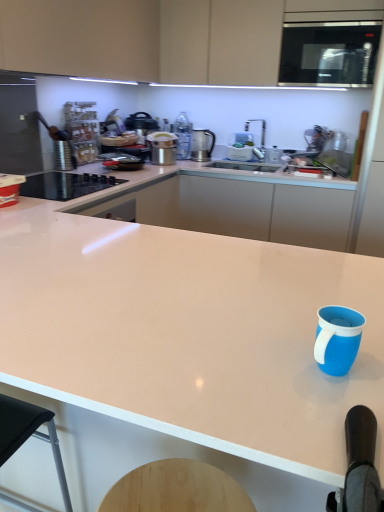
Question: Considering the relative sizes of black glass cooktop at left and white glossy countertop at center, acting as the 2th countertop starting from the back, in the image provided, is black glass cooktop at left bigger than white glossy countertop at center, acting as the 2th countertop starting from the back,?

Choices:
 (A) yes
 (B) no

Answer: (B)

Question: Does black glass cooktop at left turn towards white glossy countertop at center, which is the first countertop in front-to-back order?

Choices:
 (A) no
 (B) yes

Answer: (A)

Question: Is the depth of black glass cooktop at left less than that of white glossy countertop at center, which is the first countertop in front-to-back order?

Choices:
 (A) no
 (B) yes

Answer: (A)

Question: Is black glass cooktop at left positioned with its back to white glossy countertop at center, acting as the 2th countertop starting from the back?

Choices:
 (A) yes
 (B) no

Answer: (B)

Question: From a real-world perspective, is black glass cooktop at left beneath white glossy countertop at center, acting as the 2th countertop starting from the back?

Choices:
 (A) yes
 (B) no

Answer: (B)

Question: In terms of size, does blue matte mug at lower right appear bigger or smaller than black glass cooktop at left?

Choices:
 (A) big
 (B) small

Answer: (B)

Question: Would you say blue matte mug at lower right is to the left or to the right of black glass cooktop at left in the picture?

Choices:
 (A) right
 (B) left

Answer: (A)

Question: Is blue matte mug at lower right wider or thinner than black glass cooktop at left?

Choices:
 (A) thin
 (B) wide

Answer: (A)

Question: From a real-world perspective, relative to black glass cooktop at left, is blue matte mug at lower right vertically above or below?

Choices:
 (A) below
 (B) above

Answer: (B)

Question: Relative to blue matte mug at lower right, is white glossy countertop at center, which is the first countertop in front-to-back order, in front or behind?

Choices:
 (A) behind
 (B) front

Answer: (B)

Question: Would you say white glossy countertop at center, which is the first countertop in front-to-back order, is to the left or to the right of blue matte mug at lower right in the picture?

Choices:
 (A) right
 (B) left

Answer: (B)

Question: From the image's perspective, is white glossy countertop at center, acting as the 2th countertop starting from the back, positioned above or below blue matte mug at lower right?

Choices:
 (A) below
 (B) above

Answer: (A)

Question: In terms of height, does white glossy countertop at center, acting as the 2th countertop starting from the back, look taller or shorter compared to blue matte mug at lower right?

Choices:
 (A) tall
 (B) short

Answer: (A)

Question: Is metallic silver pot at upper center, the first kitchen appliance in the left-to-right sequence, inside or outside of white glossy countertop at center, the first countertop positioned from the back?

Choices:
 (A) inside
 (B) outside

Answer: (B)

Question: Considering the positions of metallic silver pot at upper center, which ranks as the 2th kitchen appliance in back-to-front order, and white glossy countertop at center, the first countertop positioned from the back, in the image, is metallic silver pot at upper center, which ranks as the 2th kitchen appliance in back-to-front order, wider or thinner than white glossy countertop at center, the first countertop positioned from the back,?

Choices:
 (A) thin
 (B) wide

Answer: (A)